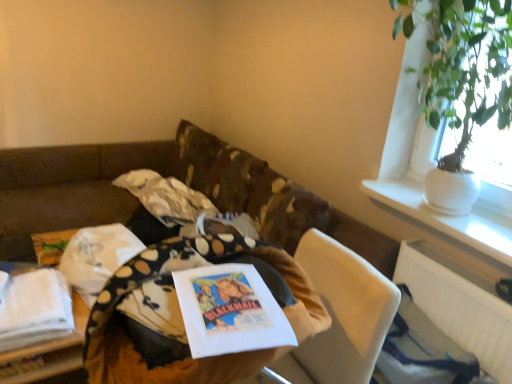
Question: From a real-world perspective, relative to white fabric at lower left, arranged as the 1th table when viewed from the back, is green leafy plant in white pot at upper right vertically above or below?

Choices:
 (A) below
 (B) above

Answer: (B)

Question: Is green leafy plant in white pot at upper right spatially inside white fabric at lower left, the first table from the left, or outside of it?

Choices:
 (A) inside
 (B) outside

Answer: (B)

Question: Considering the real-world distances, which object is closest to the green leafy plant in white pot at upper right?

Choices:
 (A) white plastic radiator at lower right
 (B) polka dot fabric at lower left, positioned as the 2th material in back-to-front order
 (C) white ceramic vase at upper right
 (D) fluffy blanket at center, the 1th material in the back-to-front sequence
 (E) white paper book at center

Answer: (C)

Question: Which object is the closest to the white fabric at lower left, arranged as the 1th table when viewed from the back?

Choices:
 (A) white paper book at center
 (B) wooden table at center, placed as the 1th table when sorted from right to left
 (C) fluffy blanket at center, the 1th material in the back-to-front sequence
 (D) white ceramic vase at upper right
 (E) green leafy plant in white pot at upper right

Answer: (B)